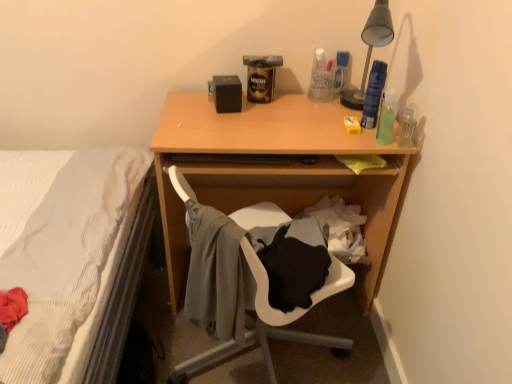
You are a GUI agent. You are given a task and a screenshot of the screen. Output one action in this format:
    pyautogui.click(x=<x>, y=<y>)
    Task: Click on the free space in front of black matte speaker at upper center
    The height and width of the screenshot is (384, 512).
    Given the screenshot: What is the action you would take?
    pyautogui.click(x=226, y=125)